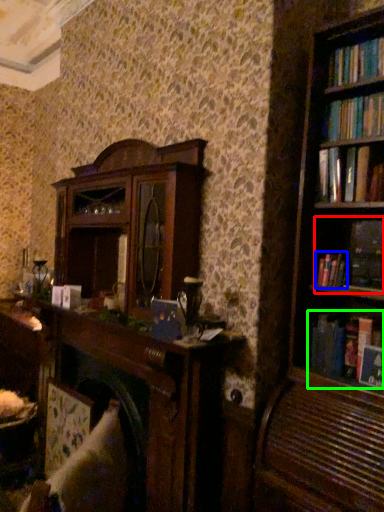
Question: Which object is positioned closest to book (highlighted by a red box)? Select from book (highlighted by a blue box) and book (highlighted by a green box).

Choices:
 (A) book
 (B) book

Answer: (A)